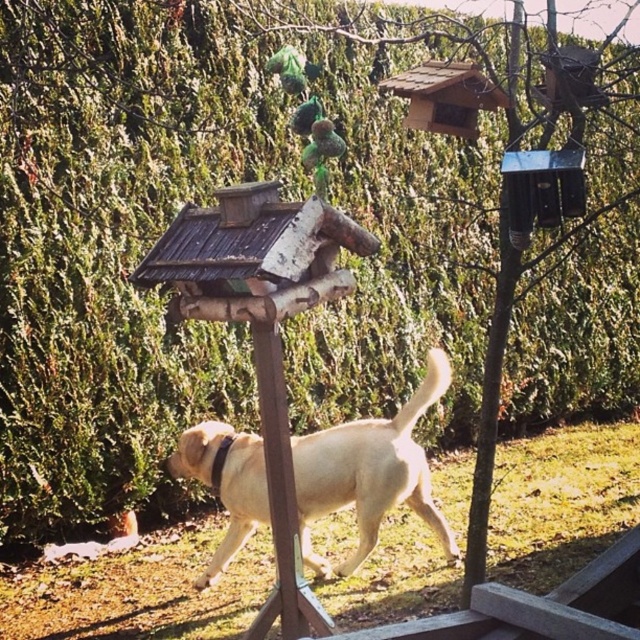
Question: Does light yellow fur at center have a lesser width compared to green fuzzy toy at center?

Choices:
 (A) yes
 (B) no

Answer: (B)

Question: Which object is the closest to the wooden bird feeder at upper center?

Choices:
 (A) green matte ornament at upper center
 (B) brown wooden pole at center
 (C) light yellow fur at center

Answer: (A)

Question: Which object is closer to the camera taking this photo?

Choices:
 (A) brown wooden pole at center
 (B) light yellow fur at center
 (C) green fuzzy toy at center
 (D) wooden bird feeder at upper center

Answer: (A)

Question: Which object appears farthest from the camera in this image?

Choices:
 (A) wooden bird feeder at upper center
 (B) green matte ornament at upper center
 (C) green matte bird at center
 (D) green fuzzy toy at center

Answer: (A)

Question: In this image, where is brown wooden pole at center located relative to green matte bird at center?

Choices:
 (A) below
 (B) above

Answer: (A)

Question: Is brown wooden pole at center further to camera compared to green fuzzy toy at center?

Choices:
 (A) no
 (B) yes

Answer: (A)